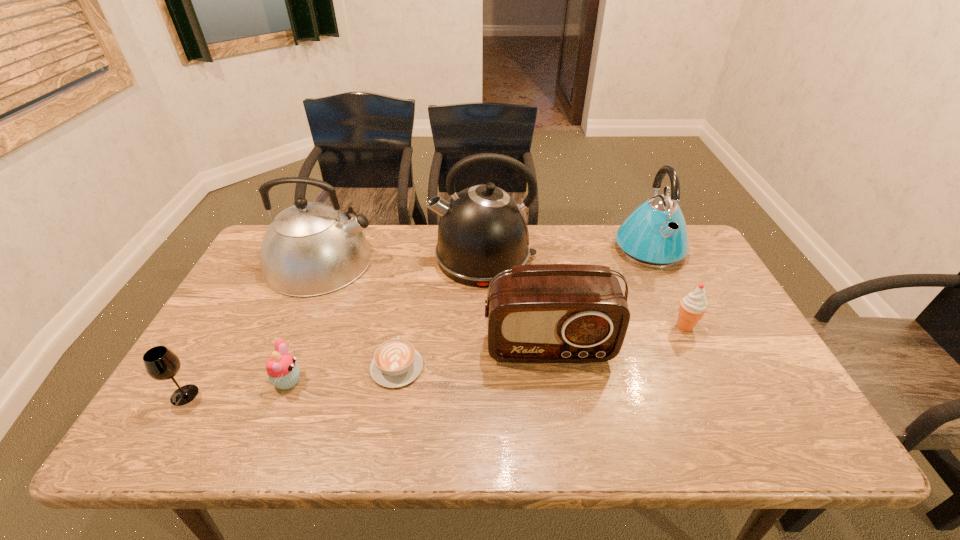
The height and width of the screenshot is (540, 960). In the image, there is a desktop. Identify the location of vacant space at the right edge. (673, 276).

Locate an element on the screen. vacant area that lies between the seventh tallest object and the wineglass is located at coordinates (236, 388).

Locate an element on the screen. vacant space in between the rightmost kettle and the second shortest object is located at coordinates (468, 314).

The height and width of the screenshot is (540, 960). In order to click on free space between the tallest kettle and the cupcake in this screenshot , I will do `click(386, 319)`.

The height and width of the screenshot is (540, 960). Identify the location of free space that is in between the rightmost kettle and the second kettle from right to left. (565, 253).

Where is `empty space that is in between the wineglass and the rightmost kettle`? The image size is (960, 540). empty space that is in between the wineglass and the rightmost kettle is located at coordinates (417, 321).

This screenshot has width=960, height=540. Find the location of `free space between the tallest kettle and the leftmost kettle`. free space between the tallest kettle and the leftmost kettle is located at coordinates (402, 259).

Select which object appears as the seventh closest to the cappuccino. Please provide its 2D coordinates. Your answer should be formatted as a tuple, i.e. [(x, y)], where the tuple contains the x and y coordinates of a point satisfying the conditions above.

[(693, 306)]

Locate which object is the seventh closest to the wineglass. Please provide its 2D coordinates. Your answer should be formatted as a tuple, i.e. [(x, y)], where the tuple contains the x and y coordinates of a point satisfying the conditions above.

[(693, 306)]

Locate an element on the screen. The width and height of the screenshot is (960, 540). kettle that is the third closest to the seventh tallest object is located at coordinates (655, 235).